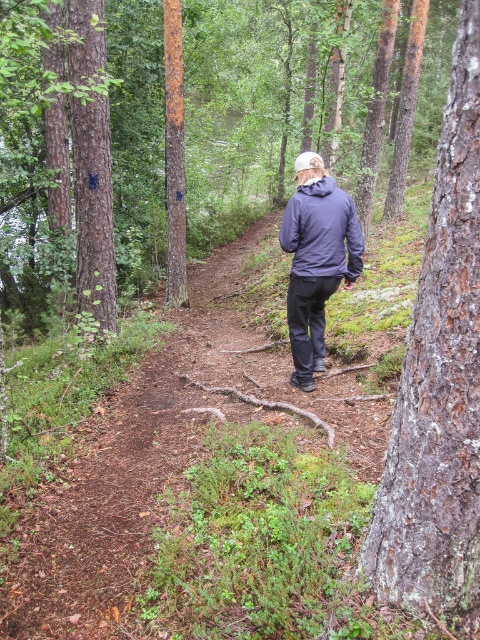
You are standing at the starting point of the forest trail and see the dark blue matte jacket at center at point (x=322, y=230). If you want to reach the jacket, should you walk towards the direction where the person is facing or the opposite direction?

The dark blue matte jacket at center is located at point (x=322, y=230), so you should walk towards the direction where the person is facing to reach it.

You are standing on the forest trail and see the dark blue matte jacket at center and the rusty metal tree at center. Which object is nearer to you?

The dark blue matte jacket at center is closer to the viewer than the rusty metal tree at center.